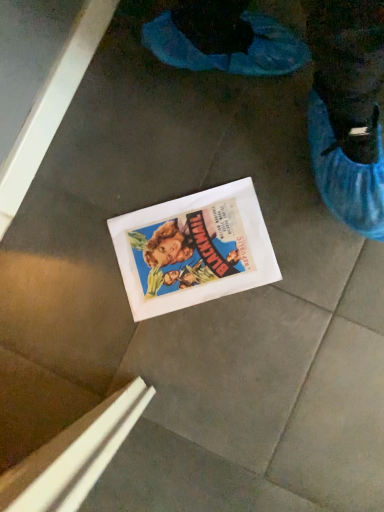
I want to click on white paper comic book at center, so click(x=193, y=249).

What do you see at coordinates (193, 249) in the screenshot? This screenshot has width=384, height=512. I see `white paper comic book at center` at bounding box center [193, 249].

You are a GUI agent. You are given a task and a screenshot of the screen. Output one action in this format:
    pyautogui.click(x=<x>, y=<y>)
    Task: Click on the white paper comic book at center
    The height and width of the screenshot is (512, 384).
    Given the screenshot: What is the action you would take?
    pyautogui.click(x=193, y=249)